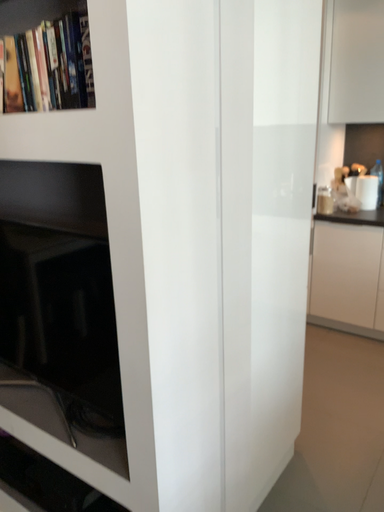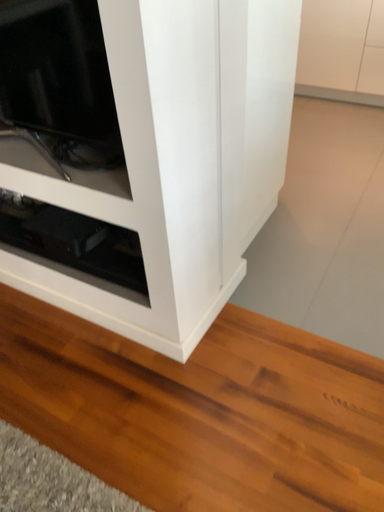
Question: Which way did the camera rotate in the video?

Choices:
 (A) rotated upward
 (B) rotated downward

Answer: (B)